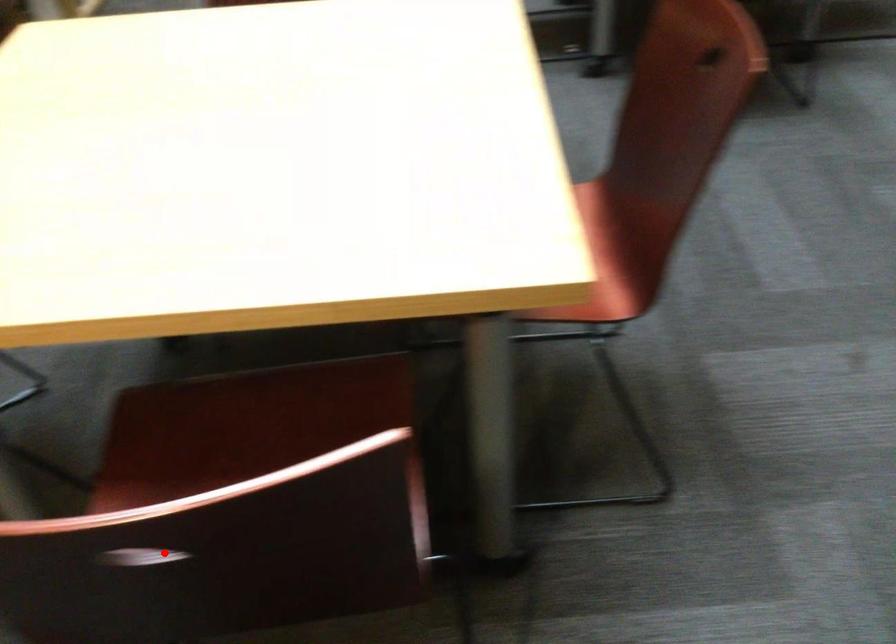
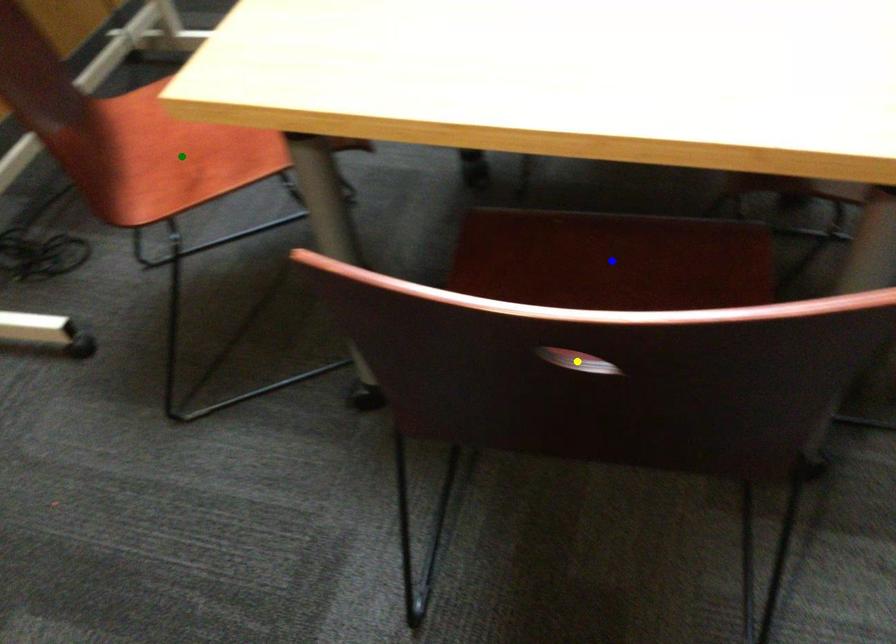
Question: I am providing you with two images of the same scene from different viewpoints. A red point is marked on the first image. You are given multiple points on the second image. In image 2, which mark is for the same physical point as the one in image 1?

Choices:
 (A) blue point
 (B) yellow point
 (C) green point

Answer: (B)